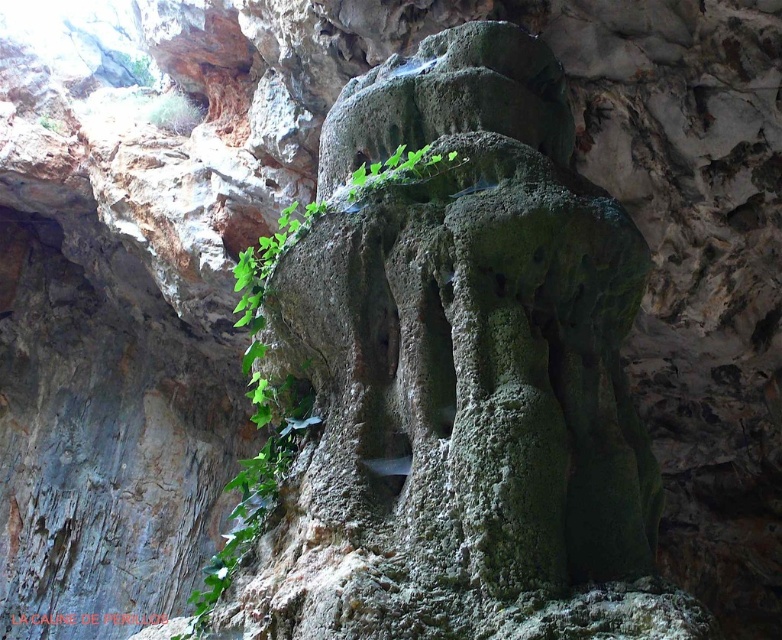
Is green mossy rock at center shorter than green leafy plant at center?

Answer: No, green mossy rock at center is not shorter than green leafy plant at center.

Who is shorter, green mossy rock at center or green leafy plant at center?

With less height is green leafy plant at center.

Is point (504, 620) more distant than point (239, 522)?

No, (504, 620) is closer to viewer.

In order to click on green mossy rock at center in this screenshot , I will do `click(461, 374)`.